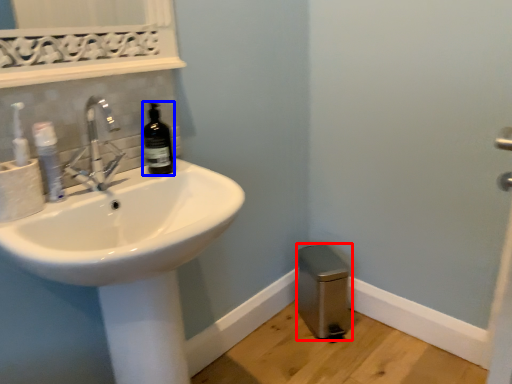
Question: Which point is closer to the camera, bidet (highlighted by a red box) or bottle (highlighted by a blue box)?

Choices:
 (A) bidet
 (B) bottle

Answer: (B)